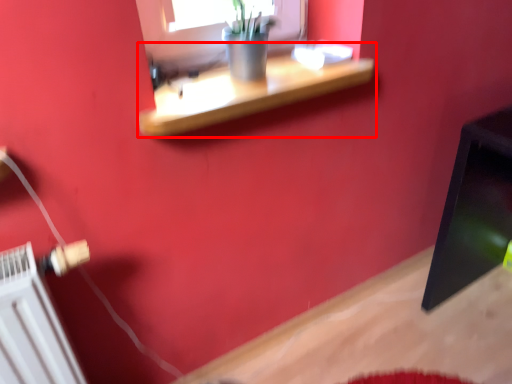
Question: From the image's perspective, what is the correct spatial relationship of shelf (annotated by the red box) in relation to radiator?

Choices:
 (A) above
 (B) below

Answer: (A)